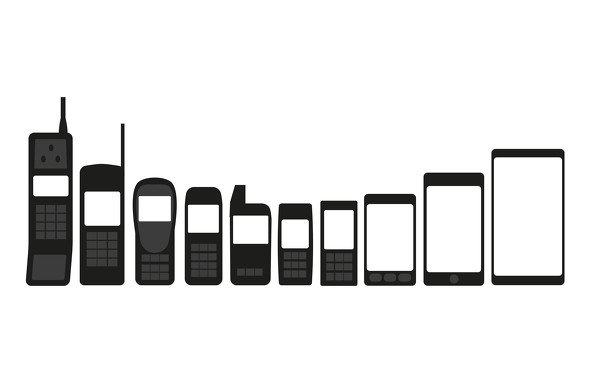
The height and width of the screenshot is (383, 590). In order to click on phones in this screenshot , I will do `click(521, 234)`, `click(445, 234)`, `click(373, 234)`, `click(329, 260)`, `click(294, 264)`, `click(249, 264)`, `click(196, 260)`, `click(154, 245)`, `click(101, 246)`, `click(52, 252)`.